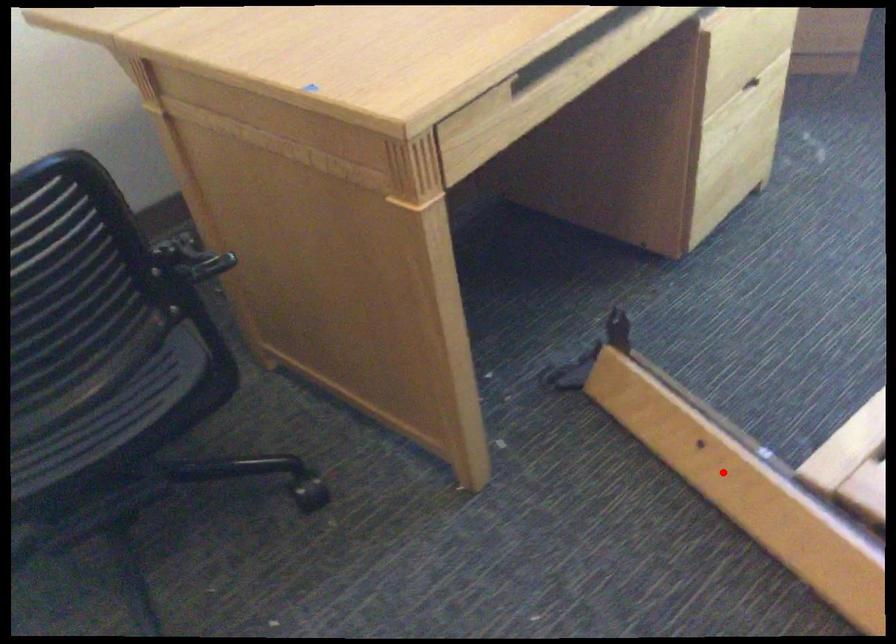
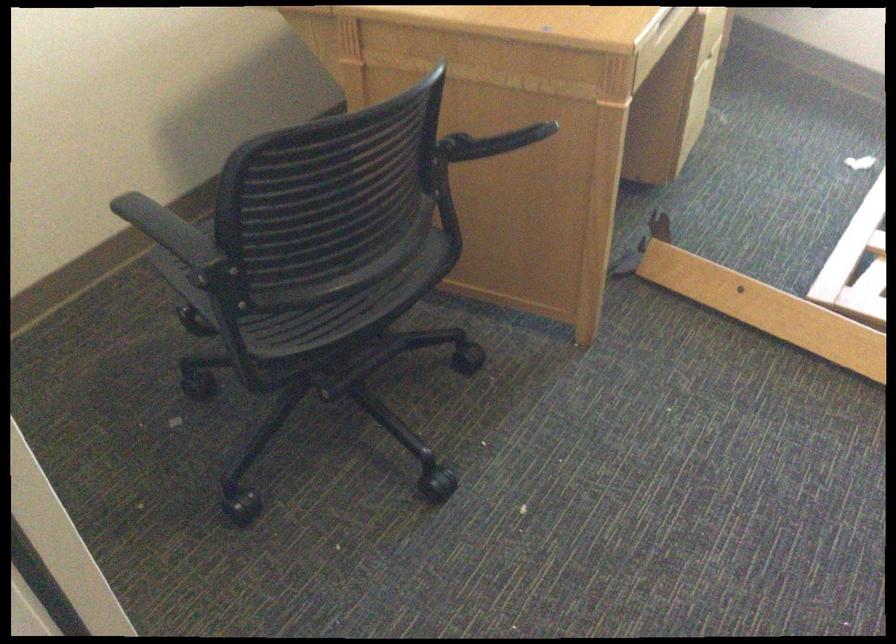
Question: I am providing you with two images of the same scene from different viewpoints. A red point is shown in image1. For the corresponding object point in image2, is it positioned nearer or farther from the camera?

Choices:
 (A) Nearer
 (B) Farther

Answer: (B)